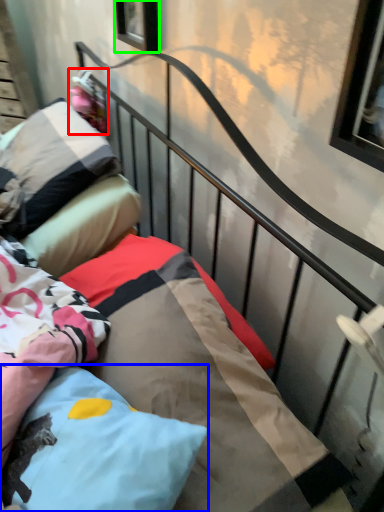
Question: Considering the real-world distances, which object is farthest from doll (highlighted by a red box)? pillow (highlighted by a blue box) or window (highlighted by a green box)?

Choices:
 (A) pillow
 (B) window

Answer: (A)